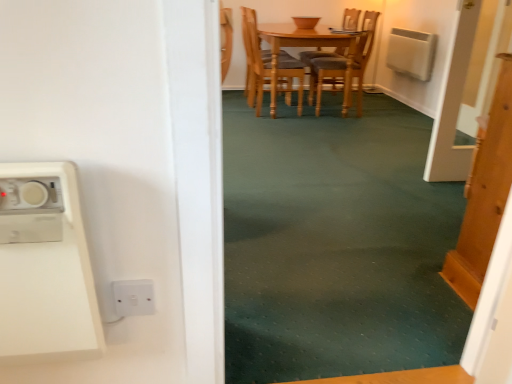
Identify the location of vacant point to the left of wooden door at right. (429, 286).